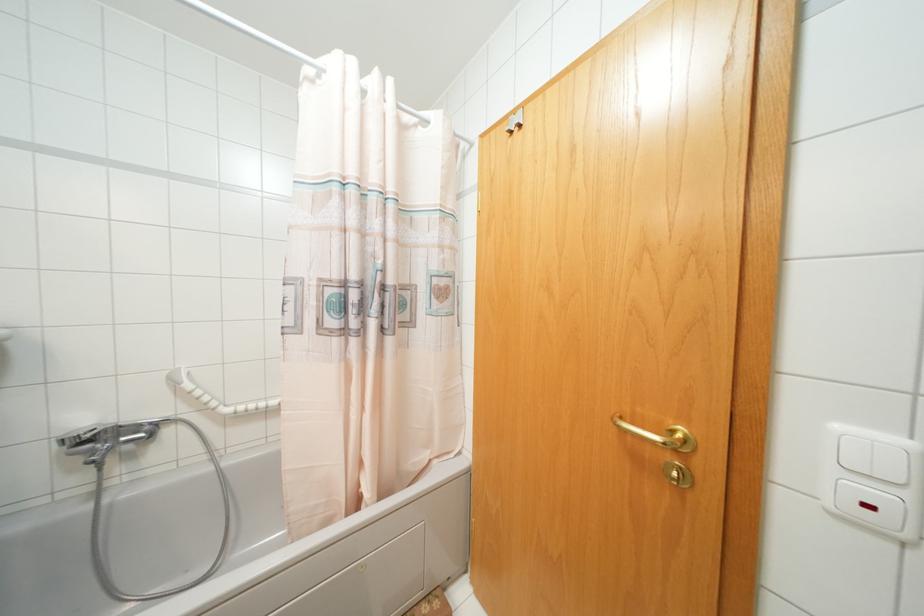
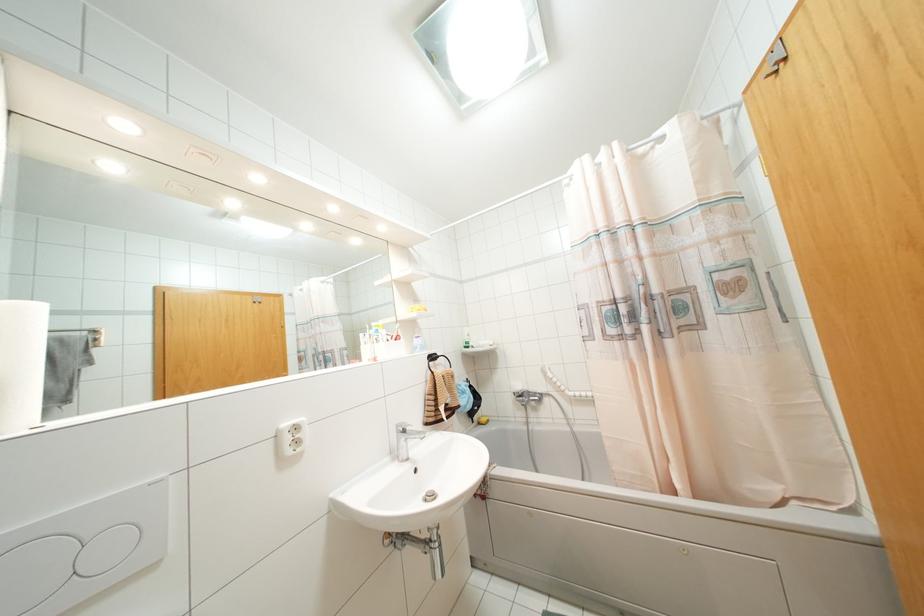
The point at (92, 451) is marked in the first image. Where is the corresponding point in the second image?

(523, 400)